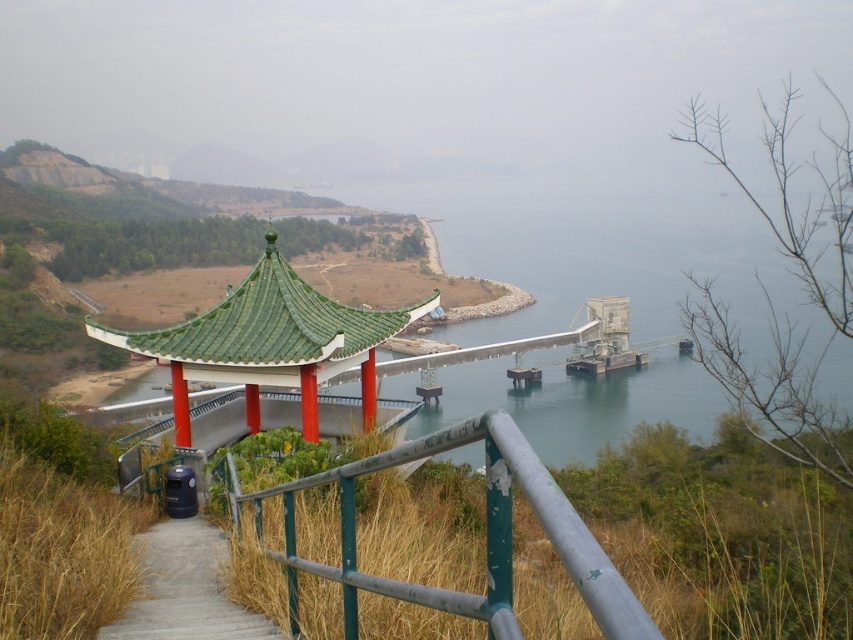
Does green glazed tile gazebo at center have a smaller size compared to wooden stairs at lower left?

Yes.

Is the position of green glazed tile gazebo at center more distant than that of wooden stairs at lower left?

Yes, it is behind wooden stairs at lower left.

The width and height of the screenshot is (853, 640). Find the location of `green glazed tile gazebo at center`. green glazed tile gazebo at center is located at coordinates (270, 342).

Is green painted metal railing at center smaller than wooden stairs at lower left?

No.

Locate an element on the screen. This screenshot has height=640, width=853. green painted metal railing at center is located at coordinates (485, 536).

Identify the location of green painted metal railing at center. (485, 536).

Does green painted metal railing at center have a larger size compared to green glazed tile gazebo at center?

Yes, green painted metal railing at center is bigger than green glazed tile gazebo at center.

Who is higher up, green painted metal railing at center or green glazed tile gazebo at center?

Positioned higher is green glazed tile gazebo at center.

Image resolution: width=853 pixels, height=640 pixels. I want to click on green painted metal railing at center, so click(x=485, y=536).

The image size is (853, 640). What are the coordinates of `green painted metal railing at center` in the screenshot? It's located at (485, 536).